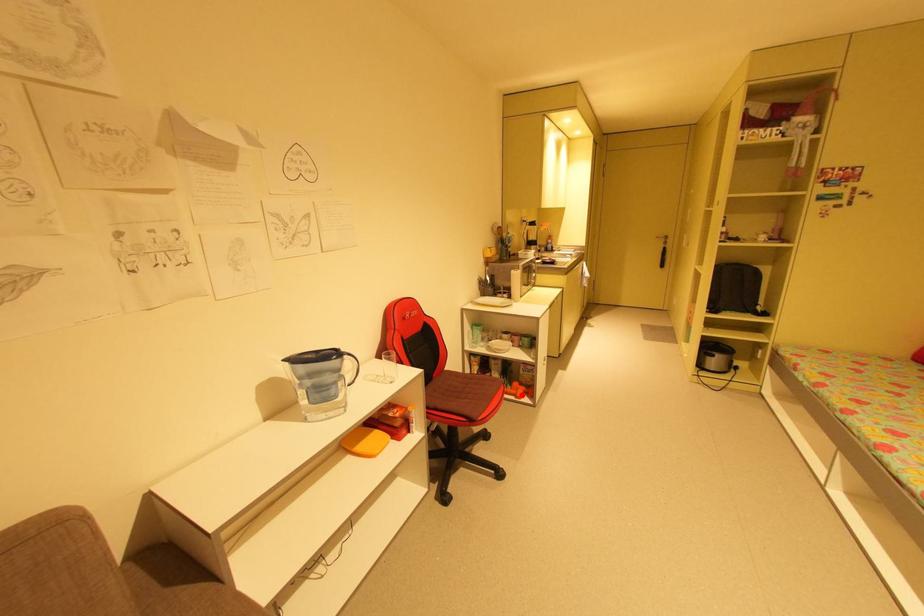
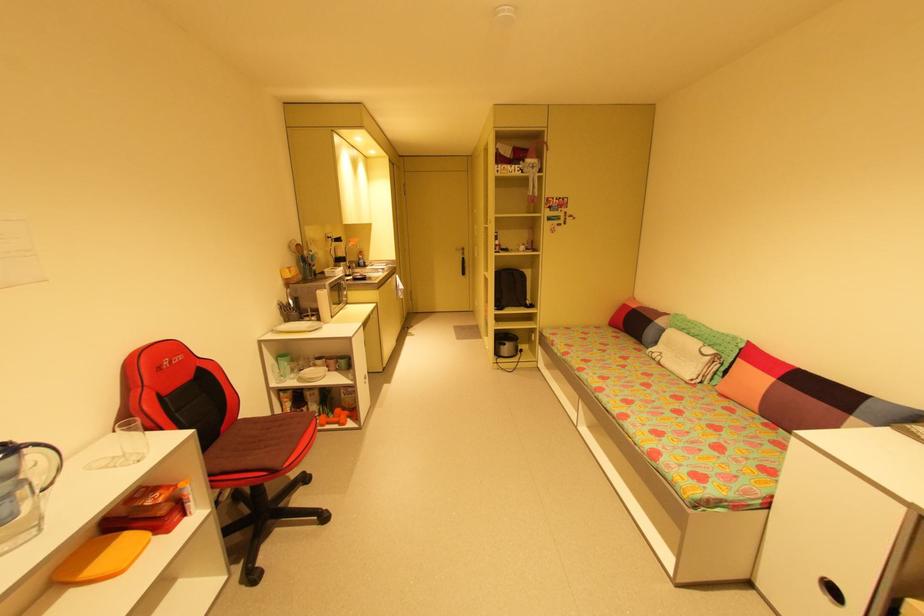
In the second image, find the point that corresponds to the highlighted location in the first image.

(345, 422)